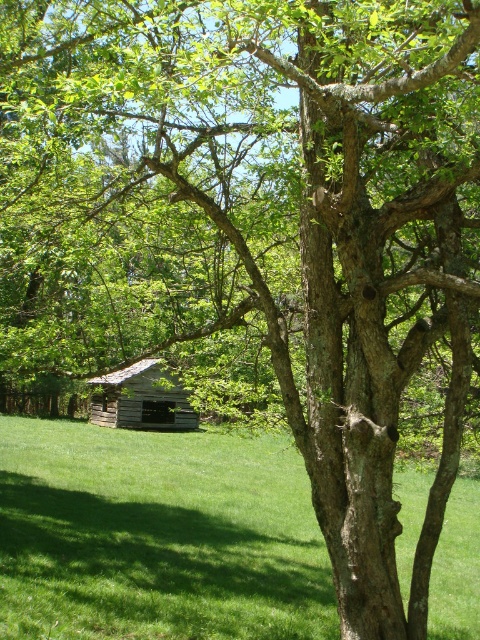
Question: Among these points, which one is farthest from the camera?

Choices:
 (A) (127, 552)
 (B) (128, 416)

Answer: (B)

Question: Which object is closer to the camera taking this photo?

Choices:
 (A) green grass at center
 (B) weathered wood cabin at center

Answer: (A)

Question: Is green grass at center smaller than weathered wood cabin at center?

Choices:
 (A) no
 (B) yes

Answer: (A)

Question: Is green grass at center further to the viewer compared to weathered wood cabin at center?

Choices:
 (A) no
 (B) yes

Answer: (A)

Question: Can you confirm if green grass at center is positioned to the left of weathered wood cabin at center?

Choices:
 (A) yes
 (B) no

Answer: (B)